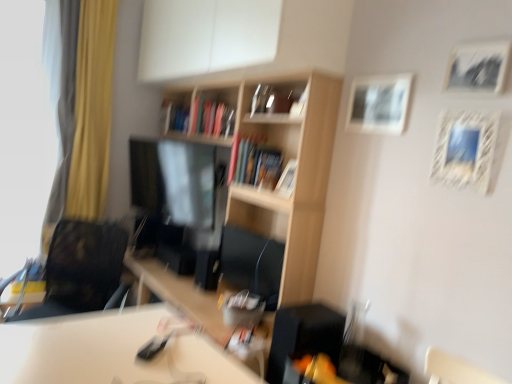
Question: In which direction should I rotate to look at wooden picture frame at center, the 4th picture frame when ordered from front to back?

Choices:
 (A) left
 (B) right

Answer: (B)

Question: Does black matte picture frame at upper right, the fourth picture frame positioned from the back, come in front of white glossy table at lower center?

Choices:
 (A) no
 (B) yes

Answer: (A)

Question: Is white glossy table at lower center located within black matte picture frame at upper right, which ranks as the 1th picture frame in front-to-back order?

Choices:
 (A) no
 (B) yes

Answer: (A)

Question: Is black matte picture frame at upper right, which ranks as the 1th picture frame in front-to-back order, next to white glossy table at lower center?

Choices:
 (A) no
 (B) yes

Answer: (A)

Question: From the image's perspective, is black matte picture frame at upper right, the fourth picture frame in the left-to-right sequence, located above white glossy table at lower center?

Choices:
 (A) no
 (B) yes

Answer: (B)

Question: Is black matte picture frame at upper right, the fourth picture frame in the left-to-right sequence, far away from white glossy table at lower center?

Choices:
 (A) no
 (B) yes

Answer: (B)

Question: Can you confirm if black matte picture frame at upper right, which ranks as the 1th picture frame in front-to-back order, is thinner than white glossy table at lower center?

Choices:
 (A) no
 (B) yes

Answer: (B)

Question: Considering the relative sizes of white matte picture frame at upper right, the 3th picture frame from the front, and hardcover book at center, which is the 2th book in top-to-bottom order, in the image provided, is white matte picture frame at upper right, the 3th picture frame from the front, bigger than hardcover book at center, which is the 2th book in top-to-bottom order,?

Choices:
 (A) yes
 (B) no

Answer: (B)

Question: Considering the relative sizes of white matte picture frame at upper right, which is the 2th picture frame from left to right, and hardcover book at center, the second book when ordered from back to front, in the image provided, is white matte picture frame at upper right, which is the 2th picture frame from left to right, smaller than hardcover book at center, the second book when ordered from back to front,?

Choices:
 (A) yes
 (B) no

Answer: (A)

Question: From a real-world perspective, is white matte picture frame at upper right, the 3th picture frame from the front, physically below hardcover book at center, the second book when ordered from back to front?

Choices:
 (A) yes
 (B) no

Answer: (B)

Question: Is hardcover book at center, the 1th book when ordered from bottom to top, located within white matte picture frame at upper right, the 2th picture frame viewed from the back?

Choices:
 (A) no
 (B) yes

Answer: (A)

Question: Is the depth of white matte picture frame at upper right, placed as the 3th picture frame when sorted from right to left, greater than that of hardcover book at center, the first book positioned from the right?

Choices:
 (A) no
 (B) yes

Answer: (A)

Question: Is white matte picture frame at upper right, placed as the 3th picture frame when sorted from right to left, positioned in front of hardcover book at center, arranged as the 1th book when viewed from the front?

Choices:
 (A) no
 (B) yes

Answer: (B)

Question: Is wooden picture frame at center, which ranks as the first picture frame in left-to-right order, turned away from white textured picture frame at upper right, arranged as the 2th picture frame when viewed from the right?

Choices:
 (A) yes
 (B) no

Answer: (B)